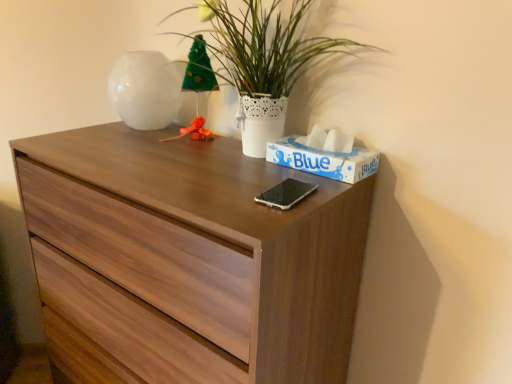
Question: Is blue cardboard tissue box at upper right positioned in front of wooden chest of drawers at center?

Choices:
 (A) yes
 (B) no

Answer: (B)

Question: Is blue cardboard tissue box at upper right not within wooden chest of drawers at center?

Choices:
 (A) no
 (B) yes

Answer: (B)

Question: Is blue cardboard tissue box at upper right positioned behind wooden chest of drawers at center?

Choices:
 (A) yes
 (B) no

Answer: (A)

Question: Are blue cardboard tissue box at upper right and wooden chest of drawers at center far apart?

Choices:
 (A) yes
 (B) no

Answer: (B)

Question: Is blue cardboard tissue box at upper right wider than wooden chest of drawers at center?

Choices:
 (A) yes
 (B) no

Answer: (B)

Question: Is blue cardboard tissue box at upper right turned away from wooden chest of drawers at center?

Choices:
 (A) yes
 (B) no

Answer: (B)

Question: Considering the relative sizes of blue cardboard tissue box at upper right and white glossy vase at upper left in the image provided, is blue cardboard tissue box at upper right wider than white glossy vase at upper left?

Choices:
 (A) yes
 (B) no

Answer: (B)

Question: From a real-world perspective, is blue cardboard tissue box at upper right below white glossy vase at upper left?

Choices:
 (A) yes
 (B) no

Answer: (A)

Question: Would you say blue cardboard tissue box at upper right is a long distance from white glossy vase at upper left?

Choices:
 (A) no
 (B) yes

Answer: (A)

Question: Considering the relative positions of blue cardboard tissue box at upper right and white glossy vase at upper left in the image provided, is blue cardboard tissue box at upper right to the left of white glossy vase at upper left from the viewer's perspective?

Choices:
 (A) yes
 (B) no

Answer: (B)

Question: From a real-world perspective, is blue cardboard tissue box at upper right physically above white glossy vase at upper left?

Choices:
 (A) yes
 (B) no

Answer: (B)

Question: Is white glossy vase at upper left surrounded by blue cardboard tissue box at upper right?

Choices:
 (A) yes
 (B) no

Answer: (B)

Question: Can you confirm if white glossy vase at upper left is shorter than blue cardboard tissue box at upper right?

Choices:
 (A) yes
 (B) no

Answer: (B)